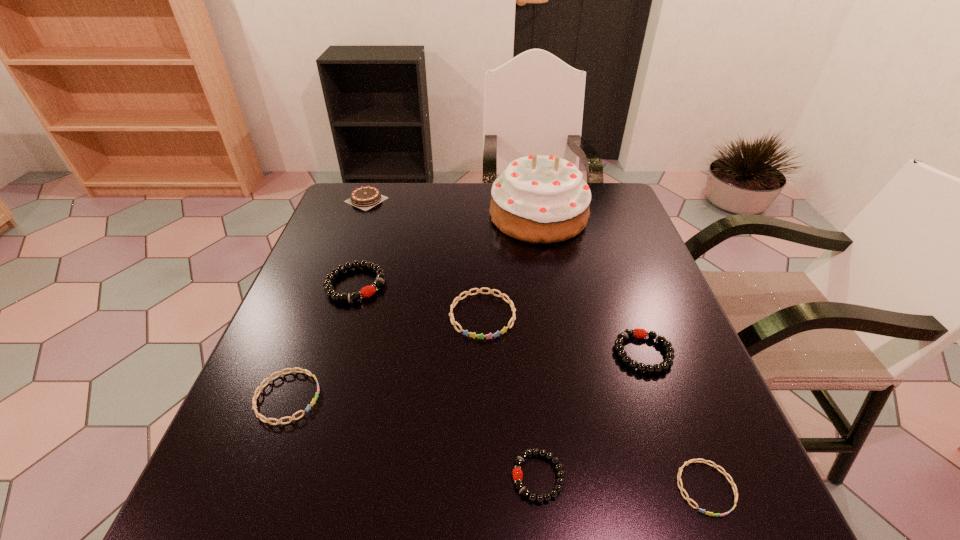
This screenshot has height=540, width=960. Identify the location of vacant space at the far edge of the desktop. (476, 203).

The height and width of the screenshot is (540, 960). In the image, there is a desktop. Identify the location of vacant space at the near edge. (618, 491).

Identify the location of vacant space at the left edge of the desktop. (348, 285).

The height and width of the screenshot is (540, 960). What are the coordinates of `free space at the right edge` in the screenshot? It's located at (632, 346).

In order to click on vacant space at the far left corner of the desktop in this screenshot , I will do `click(354, 213)`.

Locate an element on the screen. free region at the near left corner of the desktop is located at coordinates (296, 504).

Where is `vacant space at the far right corner`? This screenshot has width=960, height=540. vacant space at the far right corner is located at coordinates (627, 215).

Where is `vacant space at the near right corner of the desktop`? This screenshot has width=960, height=540. vacant space at the near right corner of the desktop is located at coordinates (725, 508).

Identify the location of vacant area that lies between the nearest blue bracelet and the biggest blue bracelet. pyautogui.click(x=594, y=402).

Locate an element on the screen. This screenshot has width=960, height=540. unoccupied position between the red cake and the farthest black bracelet is located at coordinates (447, 251).